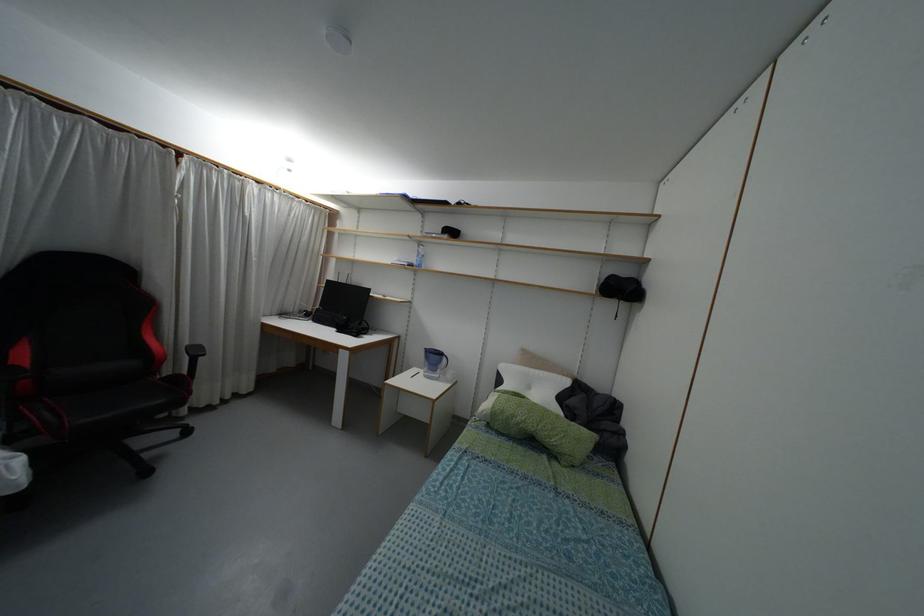
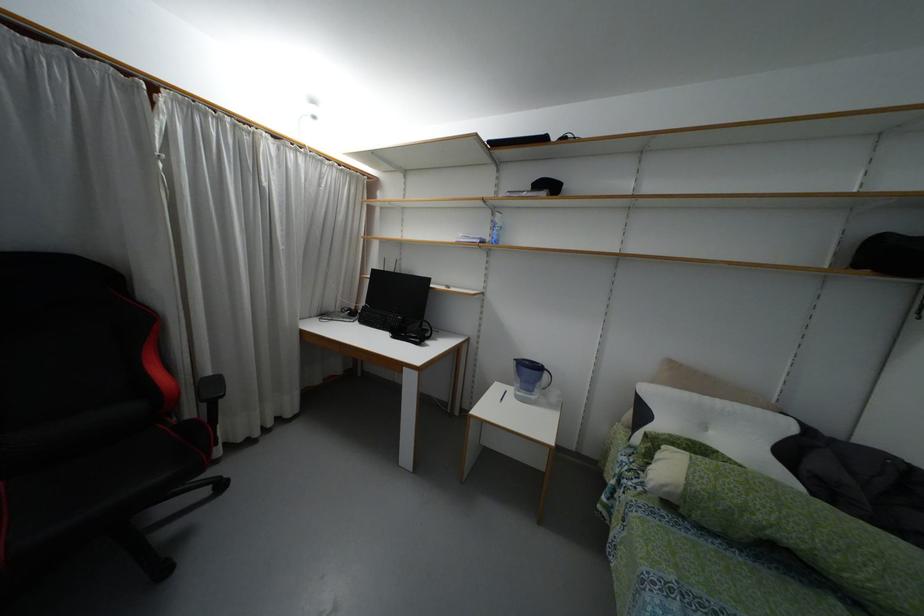
Question: How did the camera likely rotate?

Choices:
 (A) Left
 (B) Right
 (C) Up
 (D) Down

Answer: (A)